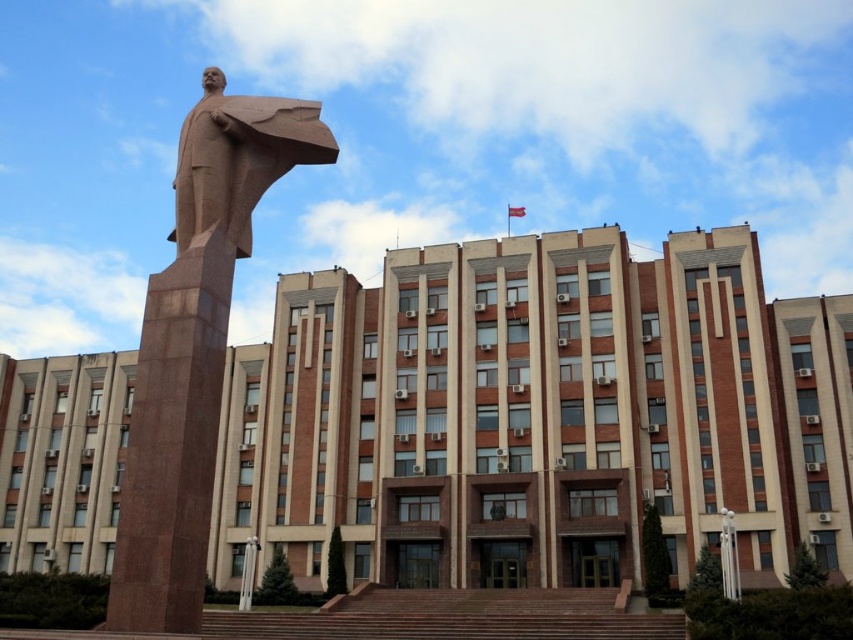
You are standing in front of the building and looking at the statue. There are two points marked on the statue. One is at coordinate point (306, 131) and the other is at point (187, 160). Which point is closer to you?

Point (187, 160) is closer to you because it is nearer to the camera than point (306, 131).